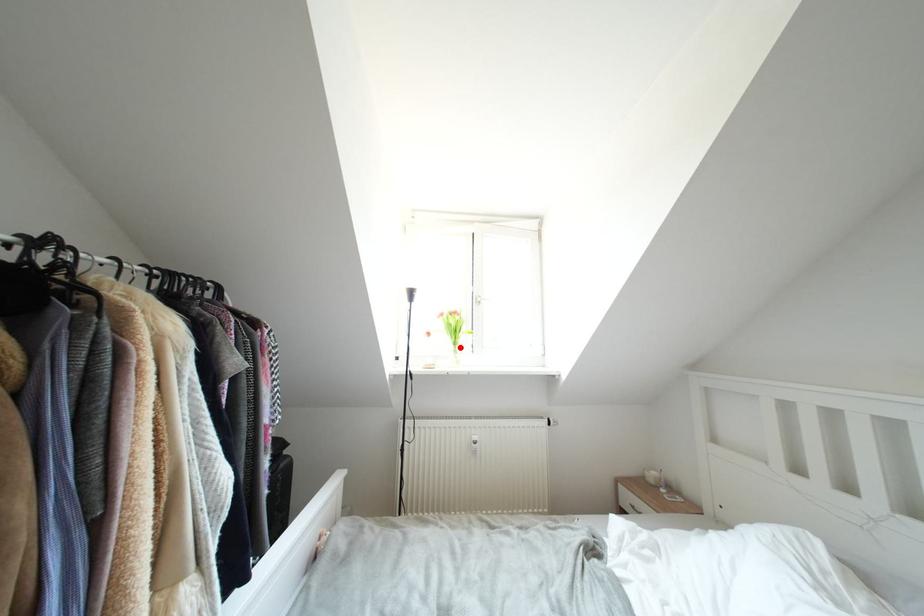
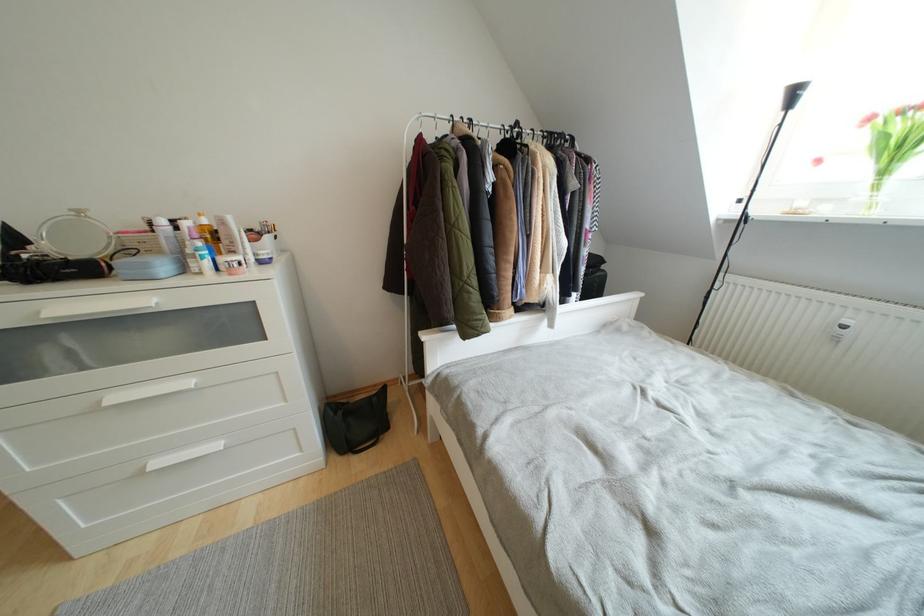
The point at the highlighted location is marked in the first image. Where is the corresponding point in the second image?

(890, 176)